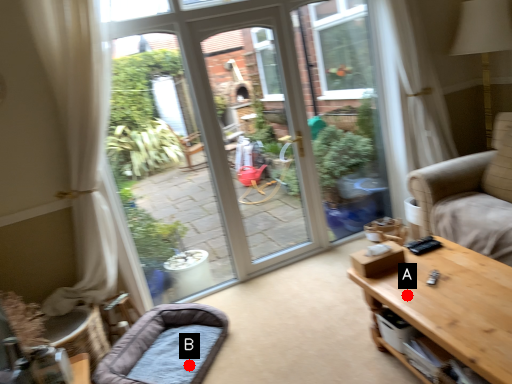
Question: Two points are circled on the image, labeled by A and B beside each circle. Which point is farther to the camera?

Choices:
 (A) A is further
 (B) B is further

Answer: (B)